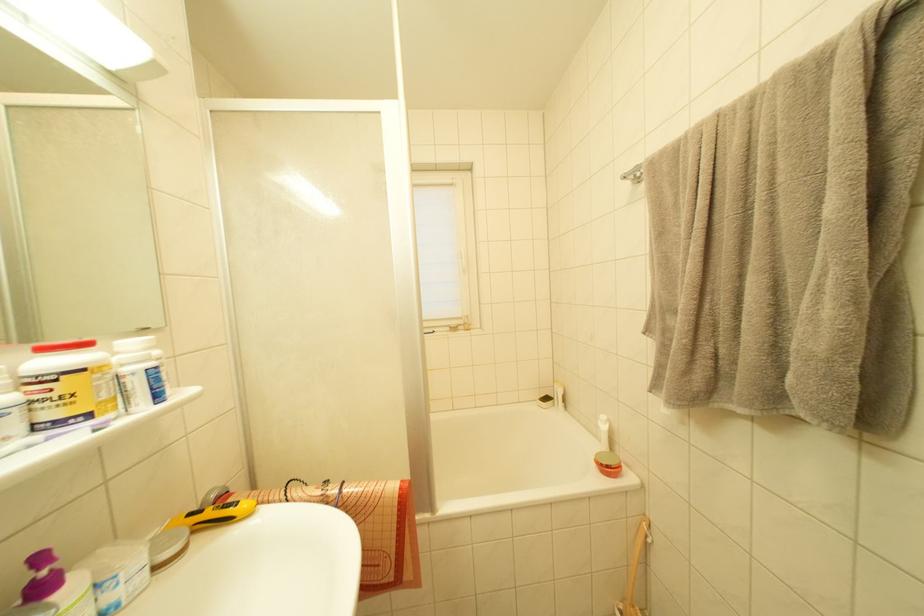
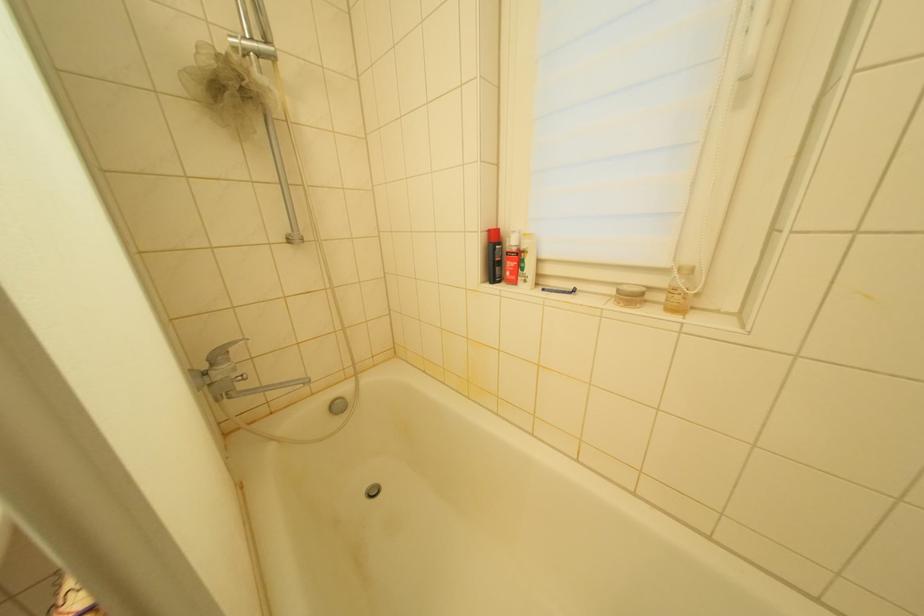
In the second image, find the point that corresponds to [455,331] in the first image.

(623, 294)